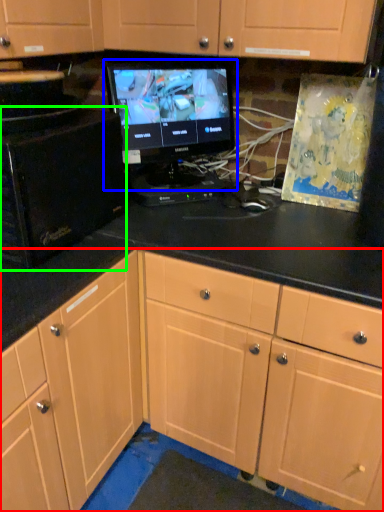
Question: Which object is the closest to the cabinetry (highlighted by a red box)? Choose among these: computer monitor (highlighted by a blue box) or desktop computer (highlighted by a green box).

Choices:
 (A) computer monitor
 (B) desktop computer

Answer: (B)